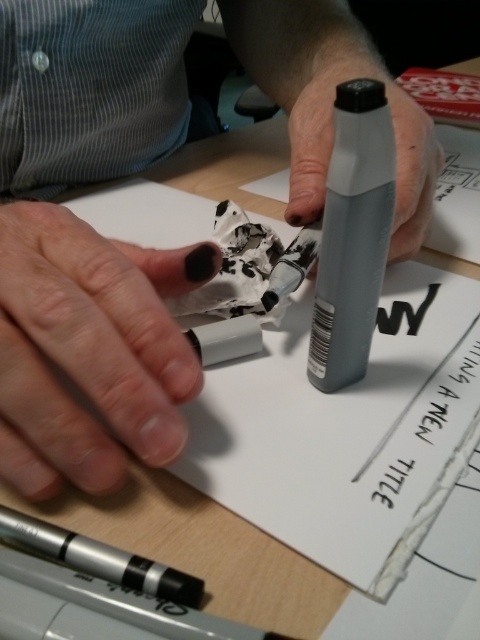
Question: Can you confirm if matte plastic marker at center is smaller than black matte pen at center?

Choices:
 (A) yes
 (B) no

Answer: (B)

Question: Which point is closer to the camera taking this photo?

Choices:
 (A) (36, 342)
 (B) (307, 172)

Answer: (A)

Question: Among these points, which one is nearest to the camera?

Choices:
 (A) (355, 60)
 (B) (96, 452)
 (C) (168, 406)

Answer: (B)

Question: Does black matte pen at center appear on the right side of matte gray marker at center?

Choices:
 (A) yes
 (B) no

Answer: (B)

Question: Which of the following is the farthest from the observer?

Choices:
 (A) (294, 88)
 (B) (118, 44)

Answer: (A)

Question: Does matte plastic marker at center appear on the left side of matte gray marker at center?

Choices:
 (A) yes
 (B) no

Answer: (A)